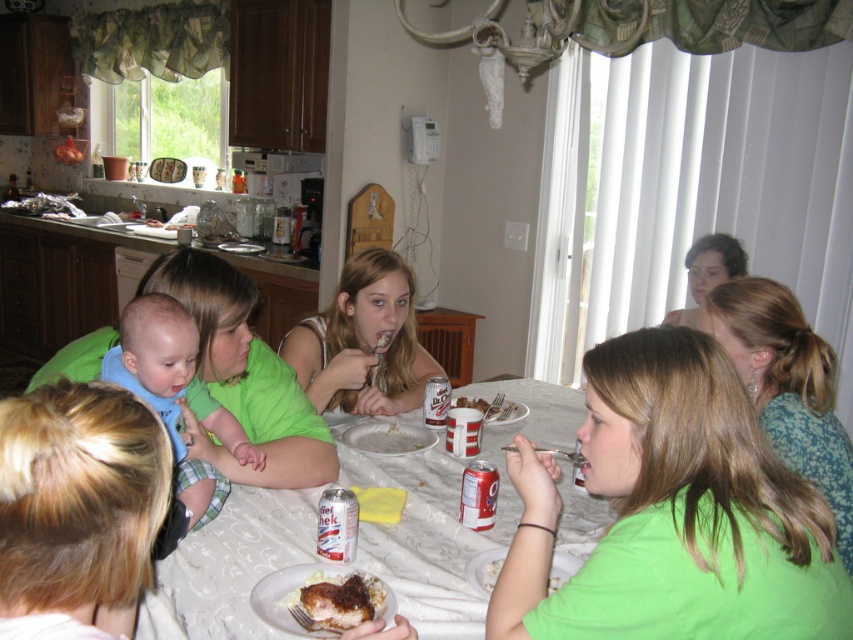
You are a guest at the family gathering and want to grab a drink from the silver metallic can at lower center. However, you need to place your white paper plate at center somewhere temporarily. Since the table is crowded, where could you put your plate so it doesn

The white paper plate at center is larger than the silver metallic can at lower center. You can place your white paper plate at center on top of the silver metallic can at lower center because it is bigger and will cover it properly.

You are a photographer trying to capture a candid shot of the blue soft fabric baby at left and the brown crispy chicken at lower center. Which object should you focus on first if you want to include both in your frame without moving the camera?

The blue soft fabric baby at left is positioned on the left side of brown crispy chicken at lower center, so you should focus on the blue soft fabric baby at left first to ensure both are in the frame without moving the camera.

You are a photographer trying to capture a closeup of the white matte can at center without the matte green shirt at upper right blocking the view. Is there enough space between them to frame the can clearly?

The matte green shirt at upper right might be wider than white matte can at center, so there might not be enough space to frame the can clearly without the shirt blocking it.